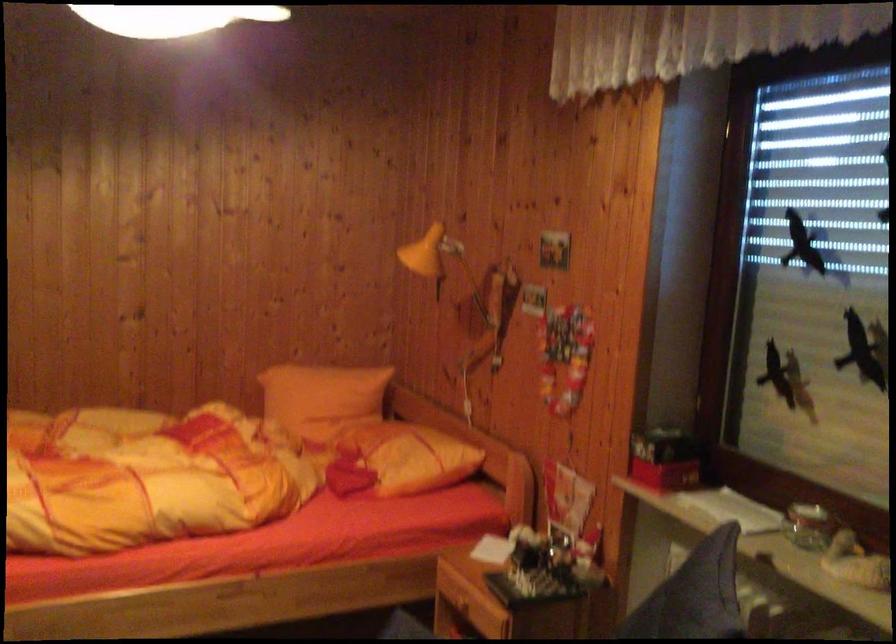
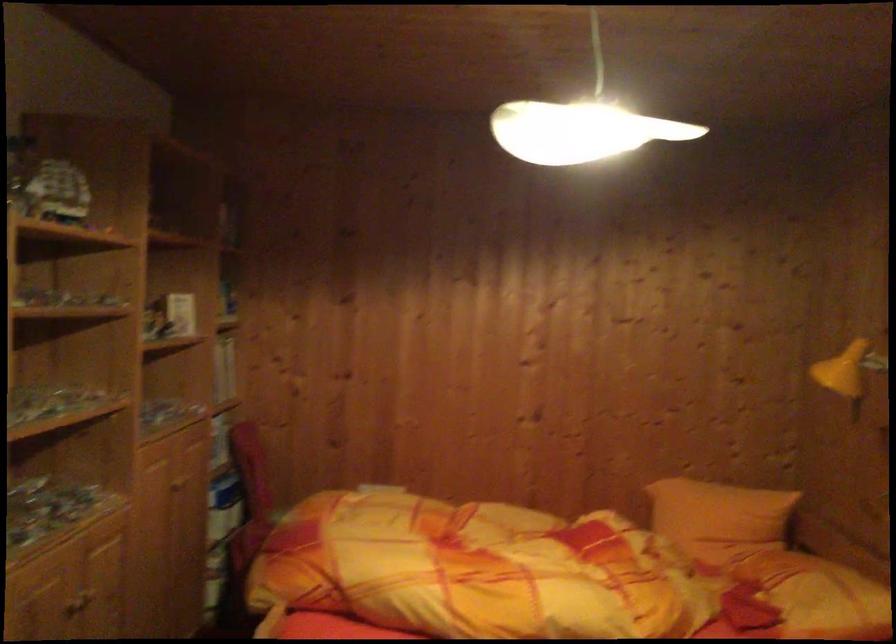
Question: The images are taken continuously from a first-person perspective. In which direction is your viewpoint rotating?

Choices:
 (A) Left
 (B) Right
 (C) Up
 (D) Down

Answer: (A)